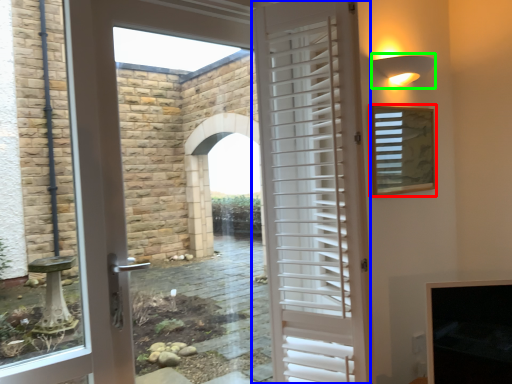
Question: Which object is the closest to the window screen (highlighted by a red box)? Choose among these: door (highlighted by a blue box) or light fixture (highlighted by a green box).

Choices:
 (A) door
 (B) light fixture

Answer: (B)